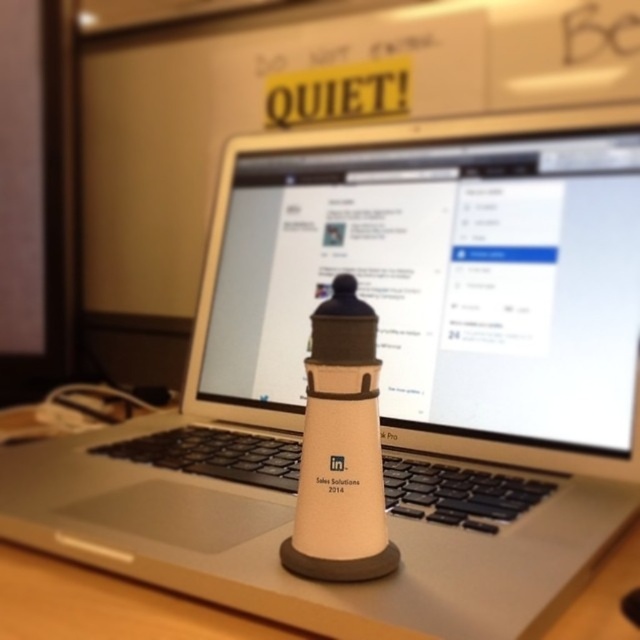
Question: Can you confirm if white matte computer screen at center is positioned to the left of white matte table at center?

Choices:
 (A) yes
 (B) no

Answer: (B)

Question: Is white matte computer screen at center closer to the viewer compared to white matte table at center?

Choices:
 (A) yes
 (B) no

Answer: (B)

Question: Which of the following is the closest to the observer?

Choices:
 (A) click(x=296, y=284)
 (B) click(x=628, y=568)

Answer: (B)

Question: Which of the following is the closest to the observer?

Choices:
 (A) (268, 196)
 (B) (541, 634)

Answer: (B)

Question: Is white matte computer screen at center in front of white matte table at center?

Choices:
 (A) no
 (B) yes

Answer: (A)